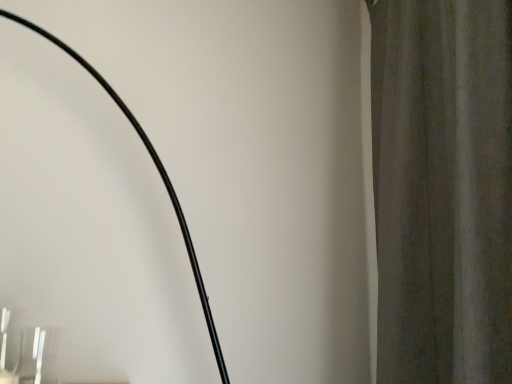
Describe the element at coordinates (442, 189) in the screenshot. I see `gray textured curtain at right` at that location.

What is the approximate height of gray textured curtain at right?

gray textured curtain at right is 1.27 meters tall.

Where is `gray textured curtain at right`? The height and width of the screenshot is (384, 512). gray textured curtain at right is located at coordinates (442, 189).

Locate an element on the screen. gray textured curtain at right is located at coordinates (442, 189).